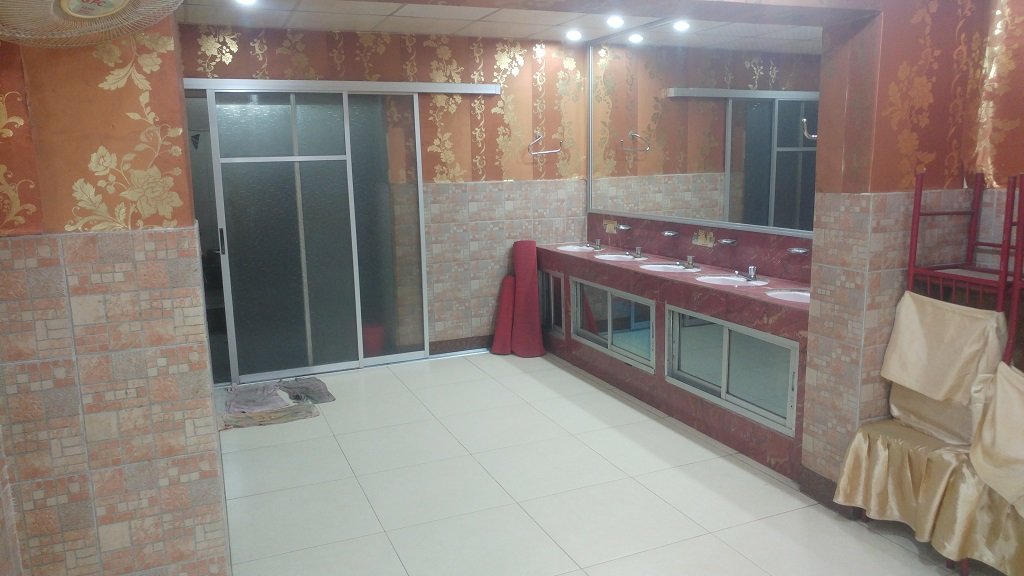
Find the location of a particular element. floor is located at coordinates (502, 486).